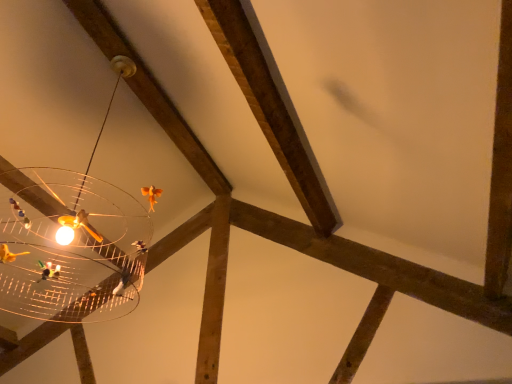
Find the location of `metallic wire chandelier at upper left`. metallic wire chandelier at upper left is located at coordinates (71, 240).

This screenshot has width=512, height=384. What do you see at coordinates (71, 240) in the screenshot? I see `metallic wire chandelier at upper left` at bounding box center [71, 240].

Measure the distance between metallic wire chandelier at upper left and camera.

metallic wire chandelier at upper left is 1.37 meters from camera.

Locate an element on the screen. The width and height of the screenshot is (512, 384). metallic wire chandelier at upper left is located at coordinates (71, 240).